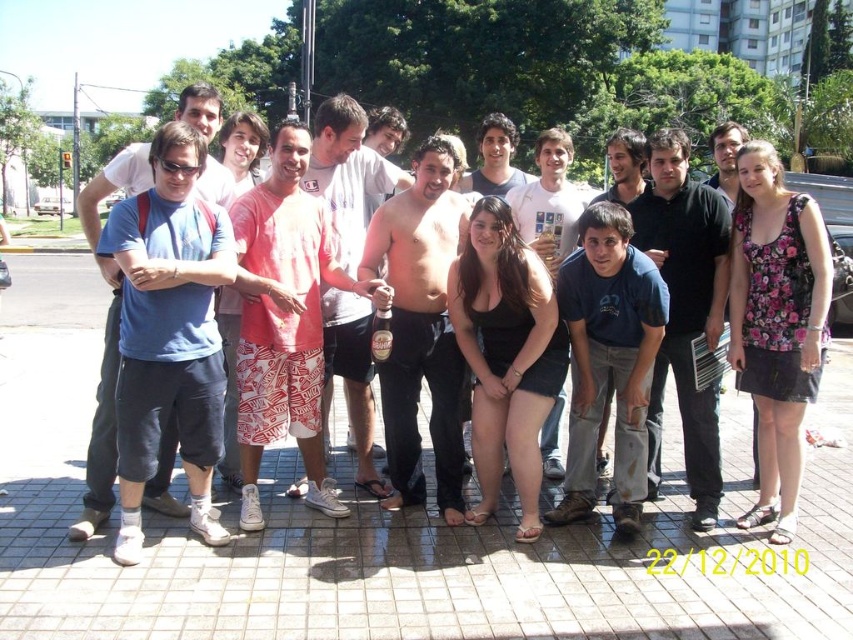
You are a photographer trying to capture a clear shot of both the black cotton shirt at center and the shiny metallic can at center. Since you want both objects in focus, which one should you adjust your camera focus on first?

The black cotton shirt at center is closer to the viewer than the shiny metallic can at center. To ensure both are in focus, you should focus on the black cotton shirt at center first, as it is closer, and the depth of field will naturally include the farther object.